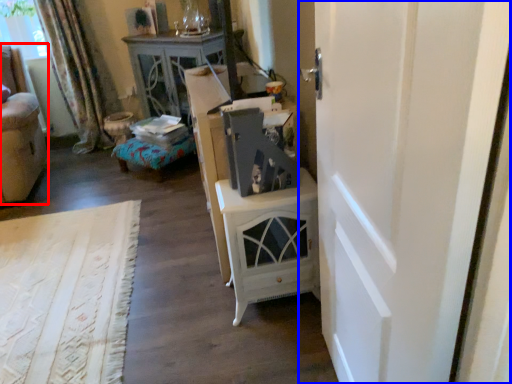
Question: Which point is further to the camera, furniture (highlighted by a red box) or door (highlighted by a blue box)?

Choices:
 (A) furniture
 (B) door

Answer: (A)